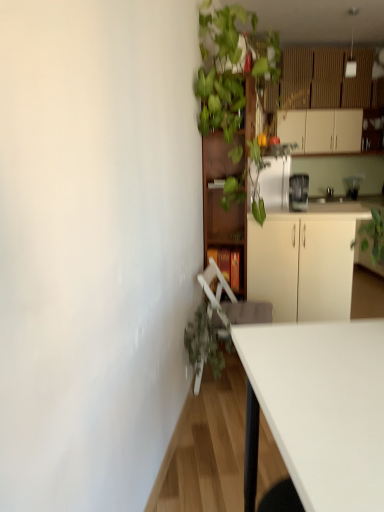
Find the location of a particular element. wooden bookshelf at upper center is located at coordinates (222, 190).

Identify the location of satin silver blender at upper right, marked as the 2th appliance in a top-to-bottom arrangement. (298, 192).

Is wooden bookshelf at upper center surrounded by white matte cabinet at upper right, the first cabinetry when ordered from right to left?

No, wooden bookshelf at upper center is not inside white matte cabinet at upper right, the first cabinetry when ordered from right to left.

From a real-world perspective, is white matte cabinet at upper right, the 3th cabinetry from the bottom, below wooden bookshelf at upper center?

No, from a real-world perspective, white matte cabinet at upper right, the 3th cabinetry from the bottom, is not under wooden bookshelf at upper center.

Who is taller, white matte cabinet at upper right, the 3th cabinetry from the bottom, or wooden bookshelf at upper center?

wooden bookshelf at upper center.

Can you confirm if white matte cabinet at upper right, acting as the first cabinetry starting from the top, is positioned to the right of wooden bookshelf at upper center?

Yes.

Looking at the image, does satin silver blender at upper right, marked as the 2th appliance in a top-to-bottom arrangement, seem bigger or smaller compared to white plastic swivel chair at lower center?

satin silver blender at upper right, marked as the 2th appliance in a top-to-bottom arrangement, is smaller than white plastic swivel chair at lower center.

From a real-world perspective, which object rests below the other?

white plastic swivel chair at lower center is physically lower.

Can you see satin silver blender at upper right, which is counted as the 2th appliance, starting from the right, touching white plastic swivel chair at lower center?

satin silver blender at upper right, which is counted as the 2th appliance, starting from the right, is not next to white plastic swivel chair at lower center, and they're not touching.

Does satin silver blender at upper right, marked as the 2th appliance in a top-to-bottom arrangement, lie in front of white plastic swivel chair at lower center?

That is False.

From the image's perspective, which object appears higher, satin silver blender at upper right, arranged as the first appliance when viewed from the left, or clear glass blender at upper right, which is counted as the second appliance, starting from the front?

From the image's view, clear glass blender at upper right, which is counted as the second appliance, starting from the front, is above.

Is satin silver blender at upper right, positioned as the second appliance in back-to-front order, located outside clear glass blender at upper right, which ranks as the 1th appliance in top-to-bottom order?

Absolutely, satin silver blender at upper right, positioned as the second appliance in back-to-front order, is external to clear glass blender at upper right, which ranks as the 1th appliance in top-to-bottom order.

Considering the sizes of satin silver blender at upper right, marked as the 2th appliance in a top-to-bottom arrangement, and clear glass blender at upper right, which ranks as the 1th appliance in right-to-left order, in the image, is satin silver blender at upper right, marked as the 2th appliance in a top-to-bottom arrangement, taller or shorter than clear glass blender at upper right, which ranks as the 1th appliance in right-to-left order,?

Considering their sizes, satin silver blender at upper right, marked as the 2th appliance in a top-to-bottom arrangement, has less height than clear glass blender at upper right, which ranks as the 1th appliance in right-to-left order.

How far apart are satin silver blender at upper right, marked as the 2th appliance in a top-to-bottom arrangement, and clear glass blender at upper right, marked as the 2th appliance in a bottom-to-top arrangement?

satin silver blender at upper right, marked as the 2th appliance in a top-to-bottom arrangement, and clear glass blender at upper right, marked as the 2th appliance in a bottom-to-top arrangement, are 1.85 meters apart from each other.

From the image's perspective, who appears lower, wooden bookshelf at upper center or satin silver blender at upper right, arranged as the first appliance when viewed from the left?

wooden bookshelf at upper center appears lower in the image.

You are a GUI agent. You are given a task and a screenshot of the screen. Output one action in this format:
    pyautogui.click(x=<x>, y=<y>)
    Task: Click on the bookshelf on the left of satin silver blender at upper right, which is counted as the 2th appliance, starting from the right
    This screenshot has height=512, width=384.
    Given the screenshot: What is the action you would take?
    pyautogui.click(x=222, y=190)

Considering the sizes of objects wooden bookshelf at upper center and satin silver blender at upper right, which is counted as the first appliance, starting from the bottom, in the image provided, who is smaller, wooden bookshelf at upper center or satin silver blender at upper right, which is counted as the first appliance, starting from the bottom,?

With smaller size is satin silver blender at upper right, which is counted as the first appliance, starting from the bottom.

Is wooden bookshelf at upper center completely or partially outside of satin silver blender at upper right, positioned as the second appliance in back-to-front order?

Absolutely, wooden bookshelf at upper center is external to satin silver blender at upper right, positioned as the second appliance in back-to-front order.

Which cabinetry is the 3rd one when counting from the back of the white plastic swivel chair at lower center? Please provide its 2D coordinates.

[(321, 130)]

Can you confirm if white matte cabinet at upper right, marked as the third cabinetry in a left-to-right arrangement, is positioned to the right of white plastic swivel chair at lower center?

Indeed, white matte cabinet at upper right, marked as the third cabinetry in a left-to-right arrangement, is positioned on the right side of white plastic swivel chair at lower center.

Are white matte cabinet at upper right, which is the first cabinetry from back to front, and white plastic swivel chair at lower center located far from each other?

Absolutely, white matte cabinet at upper right, which is the first cabinetry from back to front, is distant from white plastic swivel chair at lower center.

From the picture: From a real-world perspective, who is located higher, white matte cabinet at upper right, the first cabinetry when ordered from right to left, or white plastic swivel chair at lower center?

From a 3D spatial view, white matte cabinet at upper right, the first cabinetry when ordered from right to left, is above.

Considering the positions of objects wooden bookshelf at upper center and brown wooden bookshelf at center, placed as the 2th cabinetry when sorted from front to back, in the image provided, who is more to the left, wooden bookshelf at upper center or brown wooden bookshelf at center, placed as the 2th cabinetry when sorted from front to back,?

brown wooden bookshelf at center, placed as the 2th cabinetry when sorted from front to back, is more to the left.

Considering the sizes of objects wooden bookshelf at upper center and brown wooden bookshelf at center, which appears as the 3th cabinetry when viewed from the right, in the image provided, who is bigger, wooden bookshelf at upper center or brown wooden bookshelf at center, which appears as the 3th cabinetry when viewed from the right,?

Bigger between the two is wooden bookshelf at upper center.

From a real-world perspective, who is located lower, wooden bookshelf at upper center or brown wooden bookshelf at center, which appears as the 3th cabinetry when viewed from the right?

brown wooden bookshelf at center, which appears as the 3th cabinetry when viewed from the right, from a real-world perspective.

Is wooden bookshelf at upper center in contact with brown wooden bookshelf at center, positioned as the second cabinetry in back-to-front order?

No, wooden bookshelf at upper center is not next to brown wooden bookshelf at center, positioned as the second cabinetry in back-to-front order.

Considering the relative positions of white plastic swivel chair at lower center and green matte plant at lower left in the image provided, is white plastic swivel chair at lower center to the left of green matte plant at lower left from the viewer's perspective?

In fact, white plastic swivel chair at lower center is to the right of green matte plant at lower left.

Which object is more forward, white plastic swivel chair at lower center or green matte plant at lower left?

green matte plant at lower left is in front.

Can we say white plastic swivel chair at lower center lies outside green matte plant at lower left?

Indeed, white plastic swivel chair at lower center is completely outside green matte plant at lower left.

Image resolution: width=384 pixels, height=512 pixels. What are the coordinates of `the 3rd cabinetry behind the wooden bookshelf at upper center, starting your count from the anchor` in the screenshot? It's located at (321, 130).

Where is `swivel chair in front of the satin silver blender at upper right, which is counted as the first appliance, starting from the bottom`? swivel chair in front of the satin silver blender at upper right, which is counted as the first appliance, starting from the bottom is located at coordinates (231, 303).

Based on their spatial positions, is brown wooden bookshelf at center, arranged as the first cabinetry when viewed from the left, or green matte plant at lower left closer to white plastic swivel chair at lower center?

green matte plant at lower left is positioned closer to the anchor white plastic swivel chair at lower center.

Looking at the image, which one is located closer to brown wooden bookshelf at center, placed as the 2th cabinetry when sorted from front to back, clear glass blender at upper right, which ranks as the 1th appliance in top-to-bottom order, or green leafy plant at upper center?

Based on the image, green leafy plant at upper center appears to be nearer to brown wooden bookshelf at center, placed as the 2th cabinetry when sorted from front to back.

Looking at this image, looking at the image, which one is located closer to brown wooden bookshelf at center, acting as the 1th cabinetry starting from the bottom, white matte cabinet at center, which is the second cabinetry from top to bottom, or green matte plant at lower left?

Based on the image, green matte plant at lower left appears to be nearer to brown wooden bookshelf at center, acting as the 1th cabinetry starting from the bottom.

Considering their positions, is green leafy plant at upper center positioned closer to clear glass blender at upper right, marked as the 2th appliance in a bottom-to-top arrangement, than white plastic swivel chair at lower center?

green leafy plant at upper center is positioned closer to the anchor clear glass blender at upper right, marked as the 2th appliance in a bottom-to-top arrangement.

Estimate the real-world distances between objects in this image. Which object is further from white matte cabinet at center, acting as the 3th cabinetry starting from the back, brown wooden bookshelf at center, which appears as the 3th cabinetry when viewed from the right, or wooden bookshelf at upper center?

Based on the image, brown wooden bookshelf at center, which appears as the 3th cabinetry when viewed from the right, appears to be further to white matte cabinet at center, acting as the 3th cabinetry starting from the back.

In the scene shown: Estimate the real-world distances between objects in this image. Which object is closer to brown wooden bookshelf at center, positioned as the second cabinetry in back-to-front order, white matte cabinet at upper right, the 3th cabinetry from the bottom, or satin silver blender at upper right, marked as the 2th appliance in a top-to-bottom arrangement?

Among the two, satin silver blender at upper right, marked as the 2th appliance in a top-to-bottom arrangement, is located nearer to brown wooden bookshelf at center, positioned as the second cabinetry in back-to-front order.

Based on their spatial positions, is clear glass blender at upper right, acting as the 1th appliance starting from the back, or white matte cabinet at center, placed as the second cabinetry when sorted from right to left, further from white matte cabinet at upper right, which ranks as the 3th cabinetry in front-to-back order?

The object further to white matte cabinet at upper right, which ranks as the 3th cabinetry in front-to-back order, is white matte cabinet at center, placed as the second cabinetry when sorted from right to left.

When comparing their distances from white matte cabinet at upper right, acting as the first cabinetry starting from the top, does wooden bookshelf at upper center or white plastic swivel chair at lower center seem closer?

wooden bookshelf at upper center is positioned closer to the anchor white matte cabinet at upper right, acting as the first cabinetry starting from the top.

Where is `swivel chair between green leafy plant at upper center and white matte cabinet at upper right, the first cabinetry when ordered from right to left, in the front-back direction`? The width and height of the screenshot is (384, 512). swivel chair between green leafy plant at upper center and white matte cabinet at upper right, the first cabinetry when ordered from right to left, in the front-back direction is located at coordinates (231, 303).

Locate an element on the screen. This screenshot has height=512, width=384. bookshelf between green leafy plant at upper center and white matte cabinet at upper right, marked as the third cabinetry in a left-to-right arrangement, in the front-back direction is located at coordinates (222, 190).

The image size is (384, 512). Find the location of `appliance positioned between green leafy plant at upper center and white matte cabinet at upper right, the 3th cabinetry from the bottom, from near to far`. appliance positioned between green leafy plant at upper center and white matte cabinet at upper right, the 3th cabinetry from the bottom, from near to far is located at coordinates (298, 192).

Where is `appliance located between white plastic swivel chair at lower center and white matte cabinet at upper right, which ranks as the 3th cabinetry in front-to-back order, in the depth direction`? This screenshot has width=384, height=512. appliance located between white plastic swivel chair at lower center and white matte cabinet at upper right, which ranks as the 3th cabinetry in front-to-back order, in the depth direction is located at coordinates (298, 192).